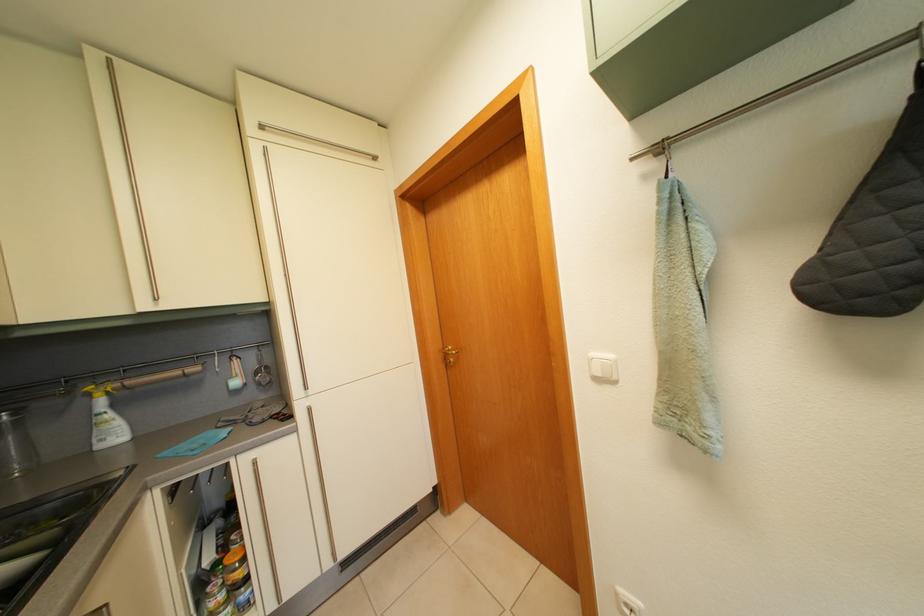
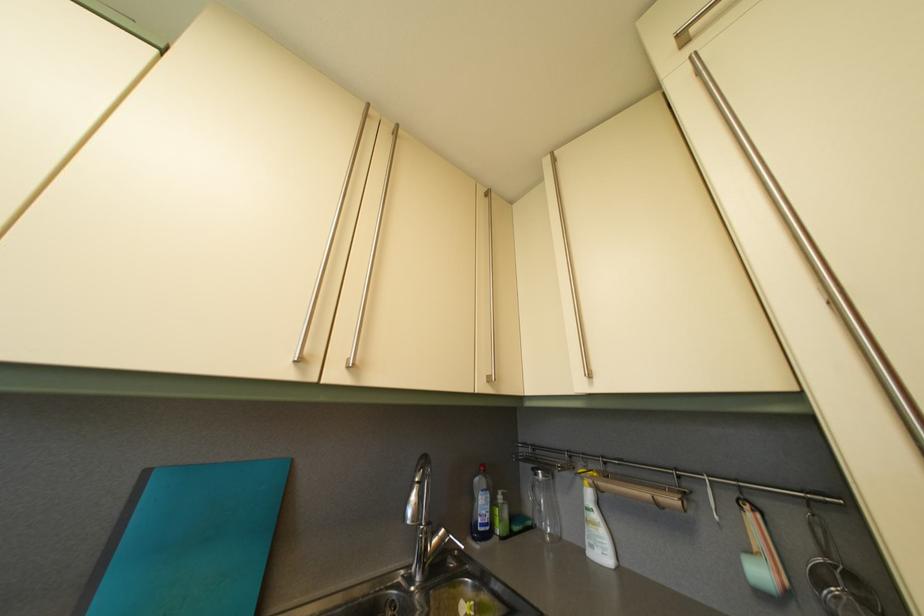
Where in the second image is the point corresponding to pixel 98 402 from the first image?

(590, 485)